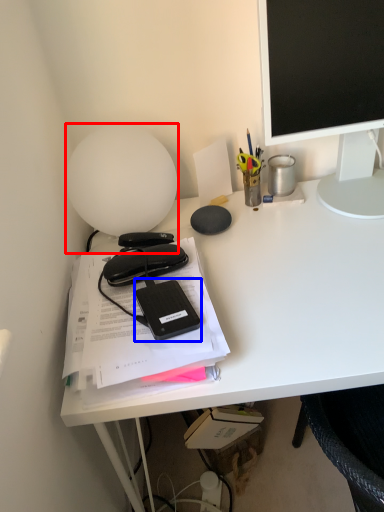
Question: Which of the following is the farthest to the observer, lamp (highlighted by a red box) or equipment (highlighted by a blue box)?

Choices:
 (A) lamp
 (B) equipment

Answer: (A)